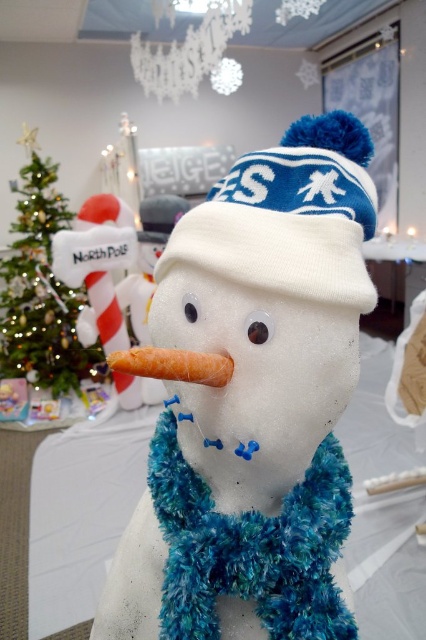
Which is in front, point (267, 170) or point (189, 372)?

Point (189, 372) is in front.

Which is behind, point (232, 266) or point (224, 374)?

Point (224, 374)

Locate an element on the screen. The height and width of the screenshot is (640, 426). white knit hat at center is located at coordinates (290, 216).

Does white fabric snowman at center have a lesser height compared to white knit hat at center?

In fact, white fabric snowman at center may be taller than white knit hat at center.

Is point (157, 282) behind point (258, 268)?

Yes, it is behind point (258, 268).

Does point (256, 586) come closer to viewer compared to point (299, 180)?

Yes, point (256, 586) is closer to viewer.

Locate an element on the screen. white fabric snowman at center is located at coordinates (255, 403).

Where is `fuzzy blue scarf at center`? The image size is (426, 640). fuzzy blue scarf at center is located at coordinates (250, 547).

Which is behind, point (316, 637) or point (273, 166)?

Point (273, 166)

Identify the location of fuzzy blue scarf at center. Image resolution: width=426 pixels, height=640 pixels. (250, 547).